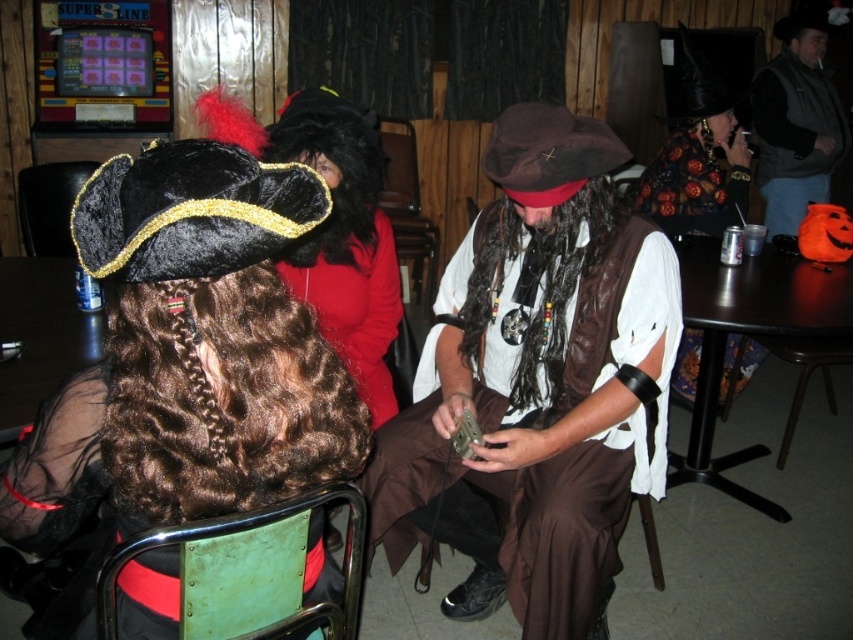
Can you confirm if brown silky wig at left is wider than floral-patterned blouse at upper right?

Incorrect, brown silky wig at left's width does not surpass floral-patterned blouse at upper right's.

Can you confirm if brown silky wig at left is positioned above floral-patterned blouse at upper right?

No.

Measure the distance between brown silky wig at left and camera.

The distance of brown silky wig at left from camera is 85.86 centimeters.

Locate an element on the screen. The height and width of the screenshot is (640, 853). brown silky wig at left is located at coordinates (223, 397).

Which of these two, brown leather vest at center or brown silky wig at left, stands taller?

With more height is brown leather vest at center.

How distant is brown leather vest at center from brown silky wig at left?

brown leather vest at center is 28.62 inches away from brown silky wig at left.

Is point (463, 372) less distant than point (146, 332)?

That is False.

Locate an element on the screen. This screenshot has width=853, height=640. brown leather vest at center is located at coordinates (537, 385).

Between brown silky wig at left and velvet black chair at left, which one has less height?

Standing shorter between the two is brown silky wig at left.

Between point (126, 339) and point (22, 228), which one is positioned behind?

Point (22, 228)

The width and height of the screenshot is (853, 640). Find the location of `brown silky wig at left`. brown silky wig at left is located at coordinates (223, 397).